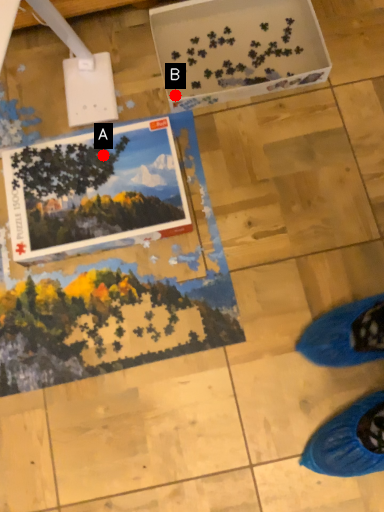
Question: Two points are circled on the image, labeled by A and B beside each circle. Which point is farther to the camera?

Choices:
 (A) A is further
 (B) B is further

Answer: (B)